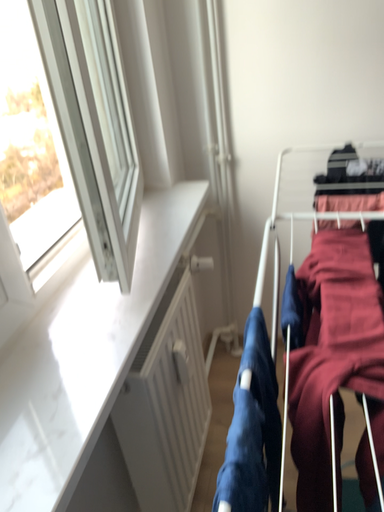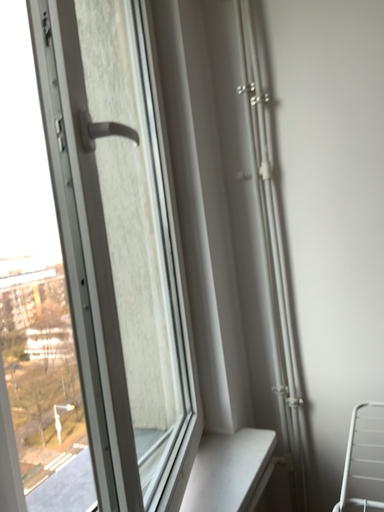
Question: Which way did the camera rotate in the video?

Choices:
 (A) rotated upward
 (B) rotated downward

Answer: (A)